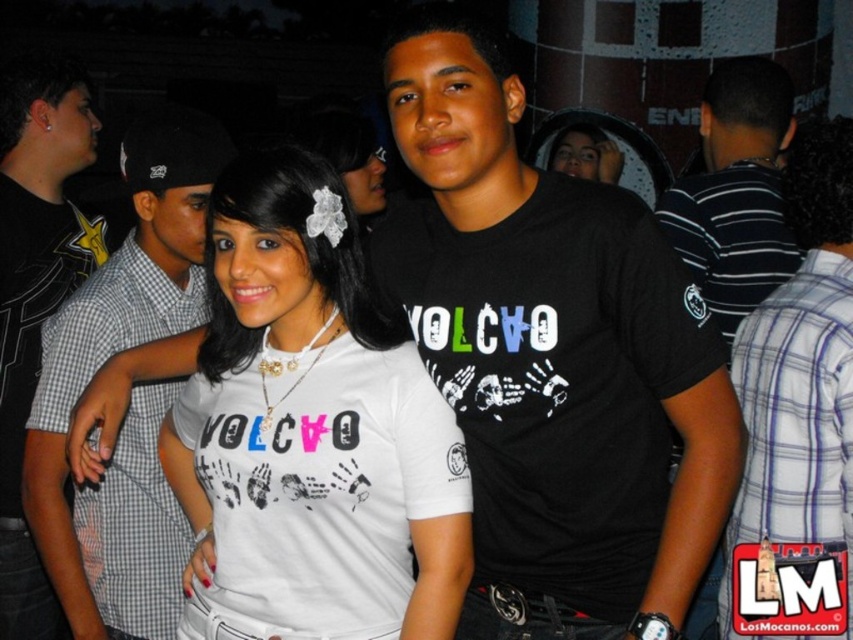
Question: Which of the following is the farthest from the observer?

Choices:
 (A) (701, 116)
 (B) (518, 282)
 (C) (585, 131)

Answer: (C)

Question: Does black matte t-shirt at center appear on the right side of white matte t-shirt at center?

Choices:
 (A) yes
 (B) no

Answer: (A)

Question: Which point is farther to the camera?

Choices:
 (A) black matte shirt at left
 (B) black matte t-shirt at center
 (C) white checkered shirt at left
 (D) matte white hair at upper center

Answer: (D)

Question: Which of the following is the farthest from the observer?

Choices:
 (A) (260, 518)
 (B) (96, 637)
 (C) (704, 408)

Answer: (B)

Question: Can you confirm if white checkered shirt at left is smaller than matte white hair at upper center?

Choices:
 (A) no
 (B) yes

Answer: (A)

Question: Does white plaid shirt at right appear on the right side of matte white hair at upper center?

Choices:
 (A) yes
 (B) no

Answer: (A)